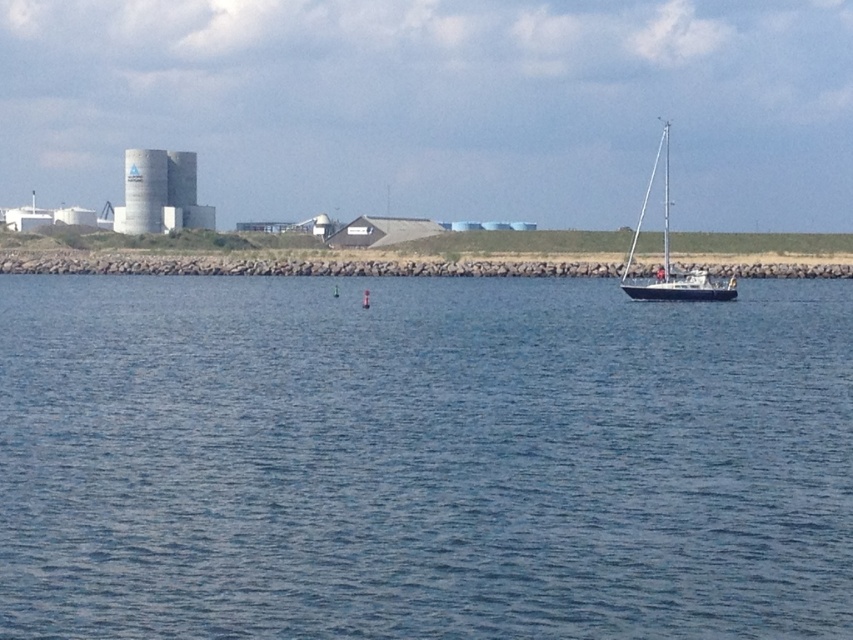
Question: Which object is farther from the camera taking this photo?

Choices:
 (A) blue water at center
 (B) white concrete silo at left
 (C) rocky shore at lower center

Answer: (B)

Question: Which of these objects is positioned farthest from the white concrete silo at left?

Choices:
 (A) blue water at center
 (B) rocky shore at lower center
 (C) white matte sailboat at right

Answer: (A)

Question: Which point appears farthest from the camera in this image?

Choices:
 (A) (734, 298)
 (B) (171, 163)

Answer: (B)

Question: Can you confirm if white concrete silo at left is thinner than white matte sailboat at right?

Choices:
 (A) yes
 (B) no

Answer: (A)

Question: Does blue water at center appear over white matte sailboat at right?

Choices:
 (A) no
 (B) yes

Answer: (A)

Question: In this image, where is blue water at center located relative to rocky shore at lower center?

Choices:
 (A) below
 (B) above

Answer: (A)